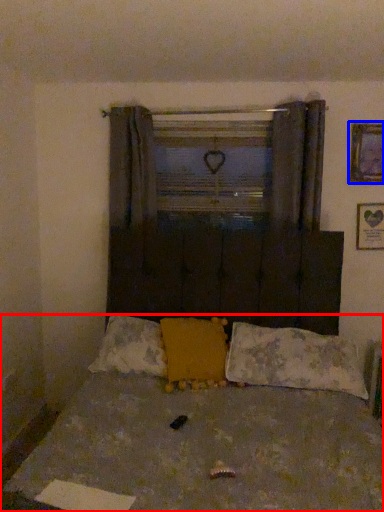
Question: Which object is closer to the camera taking this photo, bed (highlighted by a red box) or picture frame (highlighted by a blue box)?

Choices:
 (A) bed
 (B) picture frame

Answer: (A)